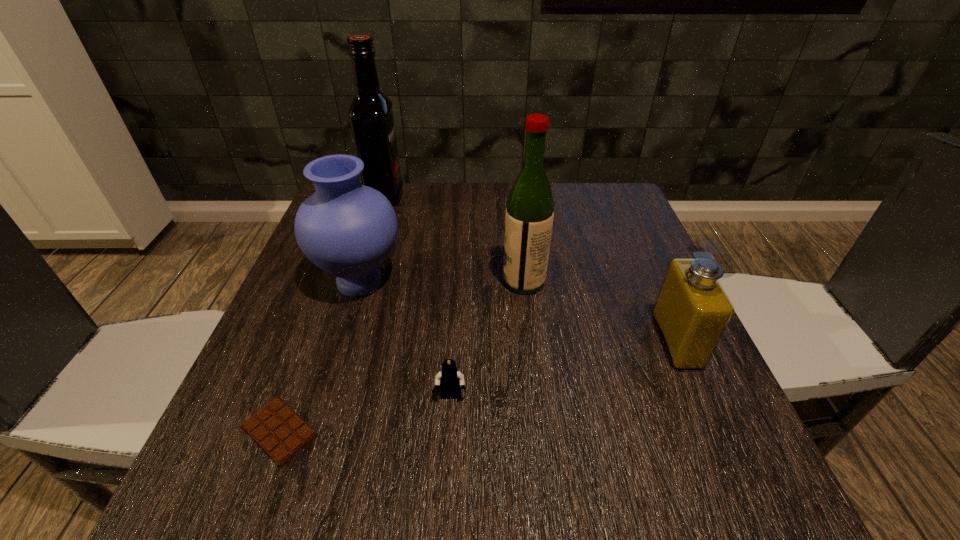
Where is `empty space that is in between the fourth object from left to right and the farthest object`? The width and height of the screenshot is (960, 540). empty space that is in between the fourth object from left to right and the farthest object is located at coordinates (418, 296).

Locate an element on the screen. vacant space that is in between the second shortest object and the left liquor is located at coordinates [418, 296].

Where is `the second closest object to the third nearest object`? This screenshot has width=960, height=540. the second closest object to the third nearest object is located at coordinates tap(450, 379).

Locate which object ranks third in proximity to the shortest object. Please provide its 2D coordinates. Your answer should be formatted as a tuple, i.e. [(x, y)], where the tuple contains the x and y coordinates of a point satisfying the conditions above.

[(529, 216)]

Image resolution: width=960 pixels, height=540 pixels. In order to click on vacant space that satisfies the following two spatial constraints: 1. on the front-facing side of the left liquor; 2. on the back side of the fourth shortest object in this screenshot , I will do `click(358, 282)`.

Find the location of a particular element. vacant area in the image that satisfies the following two spatial constraints: 1. on the front-facing side of the third nearest object; 2. on the front-facing side of the fourth object from left to right is located at coordinates (701, 397).